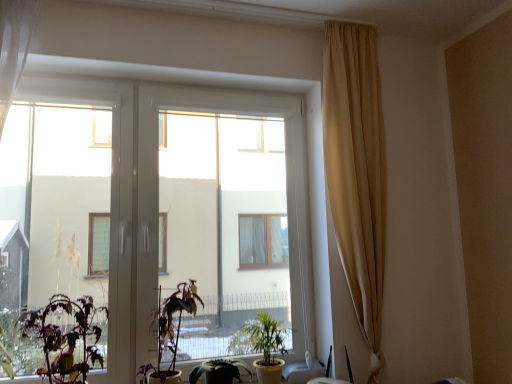
Question: From a real-world perspective, relative to purple matte plant at center, which is counted as the 2th houseplant, starting from the left, is transparent glass window at center vertically above or below?

Choices:
 (A) above
 (B) below

Answer: (A)

Question: Considering the relative positions of transparent glass window at center and purple matte plant at center, which is the third houseplant from right to left, in the image provided, is transparent glass window at center to the left or to the right of purple matte plant at center, which is the third houseplant from right to left,?

Choices:
 (A) right
 (B) left

Answer: (A)

Question: Which object is positioned farthest from the transparent glass window at center?

Choices:
 (A) green matte plant at center, positioned as the 4th houseplant in left-to-right order
 (B) beige fabric curtain at right
 (C) green matte plant at lower left, which ranks as the first houseplant in left-to-right order
 (D) purple matte plant at center, which is the third houseplant from right to left
 (E) green matte plant at lower center, the second houseplant viewed from the right

Answer: (E)

Question: Which is farther from the green matte plant at center, marked as the first houseplant in a right-to-left arrangement?

Choices:
 (A) beige fabric curtain at right
 (B) green matte plant at lower left, which ranks as the first houseplant in left-to-right order
 (C) transparent glass window at center
 (D) purple matte plant at center, which is the third houseplant from right to left
 (E) green matte plant at lower center, the second houseplant viewed from the right

Answer: (A)